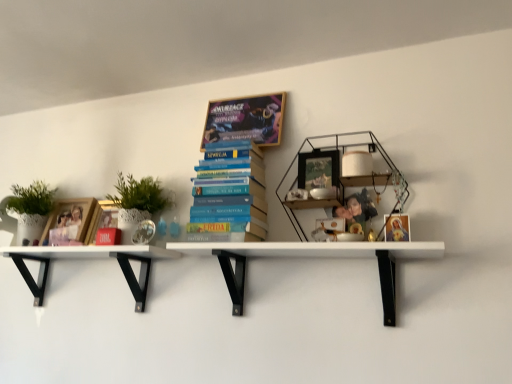
Where is `white matte shelf at lower left, which is the second shelf in right-to-left order`? This screenshot has width=512, height=384. white matte shelf at lower left, which is the second shelf in right-to-left order is located at coordinates (90, 258).

Find the location of a particular element. The width and height of the screenshot is (512, 384). woodenmaterial/texturebookcase at upper right is located at coordinates (343, 178).

Where is `white matte shelf at lower left, acting as the 1th shelf starting from the left`? The width and height of the screenshot is (512, 384). white matte shelf at lower left, acting as the 1th shelf starting from the left is located at coordinates (90, 258).

Is point (68, 239) closer or farther from the camera than point (65, 253)?

Point (68, 239) appears to be farther away from the viewer than point (65, 253).

Can you tell me how much matte wooden frame at left, which ranks as the 1th book cover in left-to-right order, and white matte shelf at lower left, acting as the 1th shelf starting from the left, differ in facing direction?

1.07 degrees separate the facing orientations of matte wooden frame at left, which ranks as the 1th book cover in left-to-right order, and white matte shelf at lower left, acting as the 1th shelf starting from the left.

Which of these two, matte wooden frame at left, placed as the 1th book cover when sorted from back to front, or white matte shelf at lower left, acting as the 1th shelf starting from the left, is bigger?

With larger size is white matte shelf at lower left, acting as the 1th shelf starting from the left.

The height and width of the screenshot is (384, 512). Identify the location of the 2nd shelf located beneath the matte wooden frame at left, which ranks as the 1th book cover in left-to-right order (from a real-world perspective). (90, 258).

Which of these two, white matte shelf at lower left, acting as the 1th shelf starting from the left, or white matte shelf at center, which is the second shelf from left to right, stands taller?

With more height is white matte shelf at lower left, acting as the 1th shelf starting from the left.

From the image's perspective, would you say white matte shelf at lower left, which is the second shelf in right-to-left order, is shown under white matte shelf at center, which is counted as the first shelf, starting from the right?

Indeed, from the image's perspective, white matte shelf at lower left, which is the second shelf in right-to-left order, is shown beneath white matte shelf at center, which is counted as the first shelf, starting from the right.

This screenshot has height=384, width=512. What are the coordinates of `shelf above the white matte shelf at lower left, acting as the 1th shelf starting from the left (from a real-world perspective)` in the screenshot? It's located at (312, 257).

Who is bigger, white matte shelf at center, which is the second shelf from left to right, or matte gold frame at upper right, the 2th book cover when ordered from left to right?

white matte shelf at center, which is the second shelf from left to right, is bigger.

Is white matte shelf at center, which is counted as the first shelf, starting from the right, oriented towards matte gold frame at upper right, which appears as the 1th book cover when viewed from the front?

No, white matte shelf at center, which is counted as the first shelf, starting from the right, is not aimed at matte gold frame at upper right, which appears as the 1th book cover when viewed from the front.

From the image's perspective, which one is positioned lower, white matte shelf at center, which is counted as the first shelf, starting from the right, or matte gold frame at upper right, the 2th book cover when ordered from left to right?

white matte shelf at center, which is counted as the first shelf, starting from the right, appears lower in the image.

Looking at this image, from a real-world perspective, which is physically above, white matte shelf at center, which is counted as the first shelf, starting from the right, or matte gold frame at upper right, which appears as the 1th book cover when viewed from the front?

matte gold frame at upper right, which appears as the 1th book cover when viewed from the front.

Between matte cardboard book at upper center, the second book in the bottom-to-top sequence, and matte black picture frame at center, which one is positioned behind?

matte cardboard book at upper center, the second book in the bottom-to-top sequence, is further from the camera.

Does point (237, 127) come in front of point (322, 174)?

No, (237, 127) is behind (322, 174).

What's the angular difference between matte cardboard book at upper center, marked as the 1th book in a top-to-bottom arrangement, and matte black picture frame at center's facing directions?

The angular difference between matte cardboard book at upper center, marked as the 1th book in a top-to-bottom arrangement, and matte black picture frame at center is 5.75 degrees.

From the image's perspective, relative to matte black picture frame at center, is matte cardboard book at upper center, the second book in the bottom-to-top sequence, above or below?

matte cardboard book at upper center, the second book in the bottom-to-top sequence, is above matte black picture frame at center.

Does white matte shelf at lower left, acting as the 1th shelf starting from the left, touch woodenmaterial/texturebookcase at upper right?

white matte shelf at lower left, acting as the 1th shelf starting from the left, is not next to woodenmaterial/texturebookcase at upper right, and they're not touching.

What's the angular difference between white matte shelf at lower left, which is the second shelf in right-to-left order, and woodenmaterial/texturebookcase at upper right's facing directions?

0.128 degrees.

Which is behind, point (143, 247) or point (341, 153)?

The point (143, 247) is more distant.

From a real-world perspective, is white matte shelf at lower left, acting as the 1th shelf starting from the left, located beneath woodenmaterial/texturebookcase at upper right?

Yes.

From a real-world perspective, is woodenmaterial/texturebookcase at upper right physically located above or below matte black picture frame at center?

woodenmaterial/texturebookcase at upper right is situated lower than matte black picture frame at center in the real world.

Is point (298, 164) positioned behind point (318, 185)?

Yes, point (298, 164) is farther from viewer.

Considering the positions of objects woodenmaterial/texturebookcase at upper right and matte black picture frame at center in the image provided, who is behind, woodenmaterial/texturebookcase at upper right or matte black picture frame at center?

matte black picture frame at center is behind.

Considering the relative positions of woodenmaterial/texturebookcase at upper right and matte black picture frame at center in the image provided, is woodenmaterial/texturebookcase at upper right to the right of matte black picture frame at center from the viewer's perspective?

Correct, you'll find woodenmaterial/texturebookcase at upper right to the right of matte black picture frame at center.

Between matte gold frame at upper right, marked as the 2th book cover in a back-to-front arrangement, and matte cardboard book at upper center, the second book in the bottom-to-top sequence, which one has smaller size?

Smaller between the two is matte gold frame at upper right, marked as the 2th book cover in a back-to-front arrangement.

This screenshot has width=512, height=384. I want to click on book cover in front of the matte cardboard book at upper center, the second book in the bottom-to-top sequence, so click(397, 227).

Considering the positions of objects matte gold frame at upper right, marked as the 1th book cover in a right-to-left arrangement, and matte cardboard book at upper center, the second book in the bottom-to-top sequence, in the image provided, who is behind, matte gold frame at upper right, marked as the 1th book cover in a right-to-left arrangement, or matte cardboard book at upper center, the second book in the bottom-to-top sequence,?

matte cardboard book at upper center, the second book in the bottom-to-top sequence, is further from the camera.

From a real-world perspective, count 2nd shelfs downward from the matte wooden frame at left, placed as the 1th book cover when sorted from back to front, and point to it. Please provide its 2D coordinates.

[(90, 258)]

Locate an element on the screen. shelf that appears in front of the white matte shelf at lower left, which is the second shelf in right-to-left order is located at coordinates (312, 257).

Based on their spatial positions, is white matte shelf at center, which is counted as the first shelf, starting from the right, or woodenmaterial/texturebookcase at upper right further from matte wooden frame at left, which is the second book cover in right-to-left order?

woodenmaterial/texturebookcase at upper right is further to matte wooden frame at left, which is the second book cover in right-to-left order.

Considering their positions, is white matte shelf at lower left, which is the second shelf in right-to-left order, positioned further to matte wooden frame at left, arranged as the 2th book cover when viewed from the front, than matte gold frame at upper right, which appears as the 1th book cover when viewed from the front?

Based on the image, matte gold frame at upper right, which appears as the 1th book cover when viewed from the front, appears to be further to matte wooden frame at left, arranged as the 2th book cover when viewed from the front.

From the image, which object appears to be nearer to white matte shelf at center, which is counted as the first shelf, starting from the right, white matte shelf at lower left, which is the second shelf in right-to-left order, or woodenmaterial/texturebookcase at upper right?

Based on the image, woodenmaterial/texturebookcase at upper right appears to be nearer to white matte shelf at center, which is counted as the first shelf, starting from the right.

When comparing their distances from woodenmaterial/texturebookcase at upper right, does white matte shelf at lower left, acting as the 1th shelf starting from the left, or matte gold frame at upper right, which appears as the 1th book cover when viewed from the front, seem further?

Based on the image, white matte shelf at lower left, acting as the 1th shelf starting from the left, appears to be further to woodenmaterial/texturebookcase at upper right.

Based on their spatial positions, is matte gold frame at upper right, the 2th book cover when ordered from left to right, or white matte shelf at center, which is the second shelf from left to right, closer to blue hardcover books at center, positioned as the second book in top-to-bottom order?

The object closer to blue hardcover books at center, positioned as the second book in top-to-bottom order, is white matte shelf at center, which is the second shelf from left to right.

Estimate the real-world distances between objects in this image. Which object is closer to matte cardboard book at upper center, marked as the 1th book in a top-to-bottom arrangement, matte wooden frame at left, which ranks as the 1th book cover in left-to-right order, or woodenmaterial/texturebookcase at upper right?

woodenmaterial/texturebookcase at upper right lies closer to matte cardboard book at upper center, marked as the 1th book in a top-to-bottom arrangement, than the other object.

Considering their positions, is matte gold frame at upper right, which appears as the 1th book cover when viewed from the front, positioned further to matte wooden frame at left, placed as the 1th book cover when sorted from back to front, than white matte shelf at center, which is counted as the first shelf, starting from the right?

matte gold frame at upper right, which appears as the 1th book cover when viewed from the front, is positioned further to the anchor matte wooden frame at left, placed as the 1th book cover when sorted from back to front.

Looking at the image, which one is located further to white matte shelf at lower left, acting as the 1th shelf starting from the left, blue hardcover books at center, positioned as the second book in top-to-bottom order, or matte gold frame at upper right, marked as the 1th book cover in a right-to-left arrangement?

matte gold frame at upper right, marked as the 1th book cover in a right-to-left arrangement, lies further to white matte shelf at lower left, acting as the 1th shelf starting from the left, than the other object.

Image resolution: width=512 pixels, height=384 pixels. What are the coordinates of `book between blue hardcover books at center, positioned as the second book in top-to-bottom order, and matte black picture frame at center, in the horizontal direction` in the screenshot? It's located at (245, 119).

Where is `shelf between white matte shelf at lower left, which is the second shelf in right-to-left order, and matte black picture frame at center from left to right`? shelf between white matte shelf at lower left, which is the second shelf in right-to-left order, and matte black picture frame at center from left to right is located at coordinates (312, 257).

At what (x,y) coordinates should I click in order to perform the action: click on bookcase located between matte cardboard book at upper center, the second book in the bottom-to-top sequence, and matte gold frame at upper right, marked as the 1th book cover in a right-to-left arrangement, in the left-right direction. Please return your answer as a coordinate pair (x, y). The height and width of the screenshot is (384, 512). Looking at the image, I should click on (343, 178).

In order to click on bookcase situated between matte black picture frame at center and matte gold frame at upper right, marked as the 1th book cover in a right-to-left arrangement, from left to right in this screenshot , I will do `click(343, 178)`.